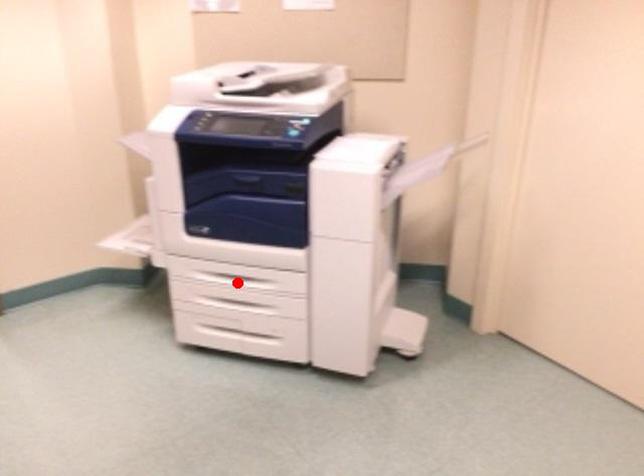
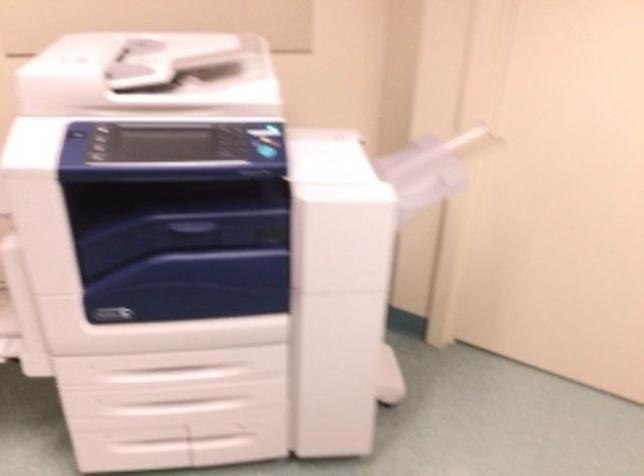
Question: I am providing you with two images of the same scene from different viewpoints. A red point is shown in image1. For the corresponding object point in image2, is it positioned nearer or farther from the camera?

Choices:
 (A) Nearer
 (B) Farther

Answer: (A)